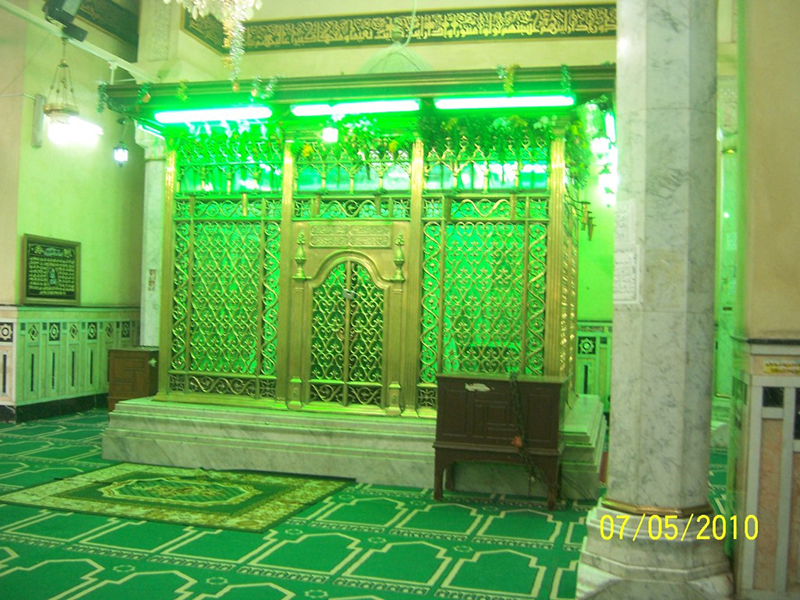
I want to click on rug, so click(182, 479).